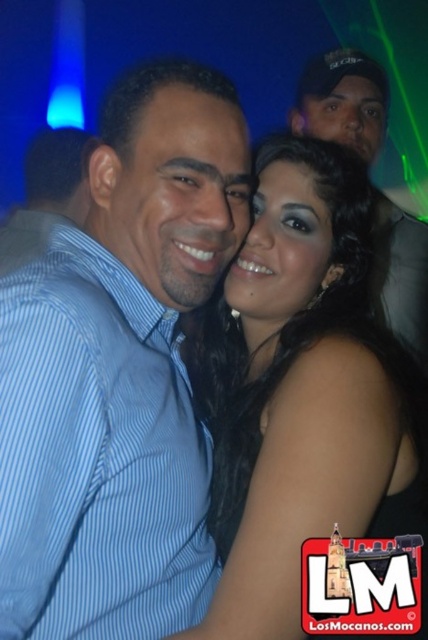
Is black satin dress at center positioned behind black cap at upper right?

No.

Which is in front, point (240, 388) or point (362, 90)?

Positioned in front is point (240, 388).

Find the location of a particular element. black satin dress at center is located at coordinates (303, 387).

Does blue striped shirt at center come in front of blue striped shirt at left?

Yes, it is.

Does blue striped shirt at center have a lesser height compared to blue striped shirt at left?

No.

The image size is (428, 640). Find the location of `blue striped shirt at center`. blue striped shirt at center is located at coordinates point(116,369).

Looking at this image, is the position of blue striped shirt at center less distant than that of black cap at upper right?

Yes, it is.

Is blue striped shirt at center wider than black cap at upper right?

Correct, the width of blue striped shirt at center exceeds that of black cap at upper right.

The width and height of the screenshot is (428, 640). In order to click on blue striped shirt at center in this screenshot , I will do `click(116, 369)`.